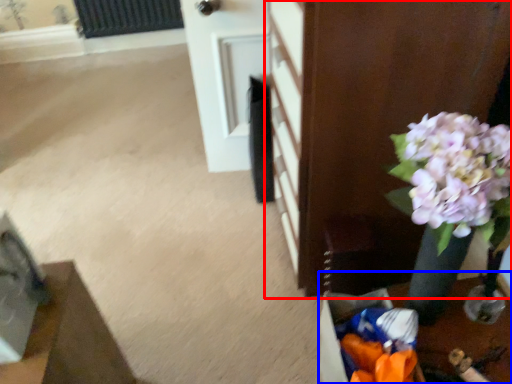
Question: Which point is further to the camera, furniture (highlighted by a red box) or table (highlighted by a blue box)?

Choices:
 (A) furniture
 (B) table

Answer: (B)